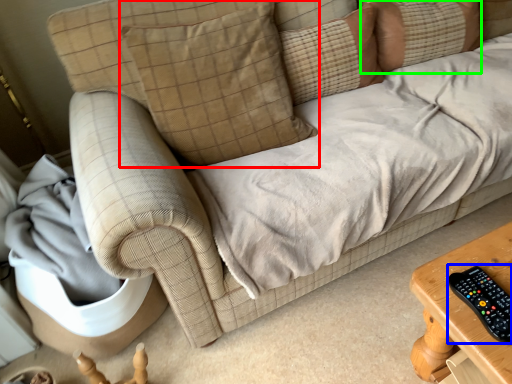
Question: Based on their relative distances, which object is farther from pillow (highlighted by a red box)? Choose from control (highlighted by a blue box) and pillow (highlighted by a green box).

Choices:
 (A) control
 (B) pillow

Answer: (A)